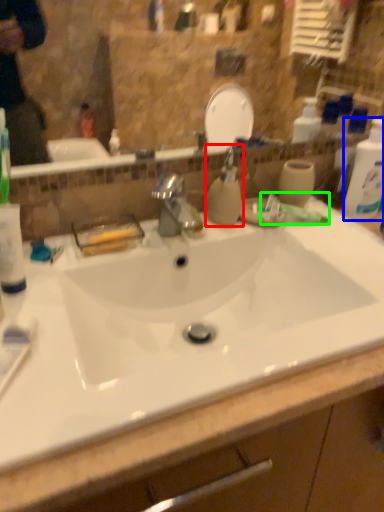
Question: Which object is positioned farthest from soap dispenser (highlighted by a red box)? Select from cleaning product (highlighted by a blue box) and toothpaste (highlighted by a green box).

Choices:
 (A) cleaning product
 (B) toothpaste

Answer: (A)